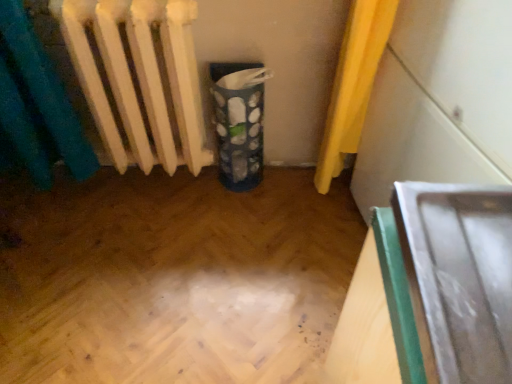
Question: Visually, is metallic silver tray at lower right, which is the second wide from right to left, positioned to the left or to the right of blue fabric recycling bin at center?

Choices:
 (A) left
 (B) right

Answer: (B)

Question: In the image, is metallic silver tray at lower right, which is the second wide from right to left, positioned in front of or behind blue fabric recycling bin at center?

Choices:
 (A) behind
 (B) front

Answer: (B)

Question: Estimate the real-world distances between objects in this image. Which object is farther from the metallic silver tray at right, which appears as the 1th wide when viewed from the right?

Choices:
 (A) metallic silver tray at lower right, which is the second wide from right to left
 (B) white matte radiator at left
 (C) blue fabric recycling bin at center

Answer: (B)

Question: Which object is positioned farthest from the white matte radiator at left?

Choices:
 (A) metallic silver tray at right, which appears as the 1th wide when viewed from the right
 (B) blue fabric recycling bin at center
 (C) metallic silver tray at lower right, which is the first wide from left to right

Answer: (C)